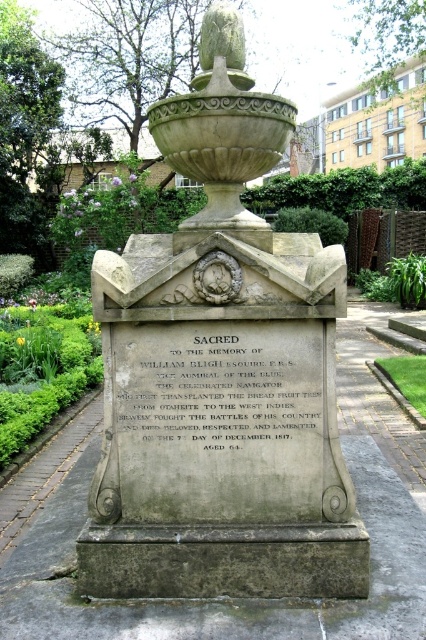
Can you confirm if gray stone monument at center is shorter than gray stone plaque at center?

No, gray stone monument at center is not shorter than gray stone plaque at center.

Does gray stone monument at center appear on the left side of gray stone plaque at center?

In fact, gray stone monument at center is to the right of gray stone plaque at center.

The image size is (426, 640). What are the coordinates of `gray stone monument at center` in the screenshot? It's located at (221, 374).

Where is `gray stone monument at center`? This screenshot has height=640, width=426. gray stone monument at center is located at coordinates (221, 374).